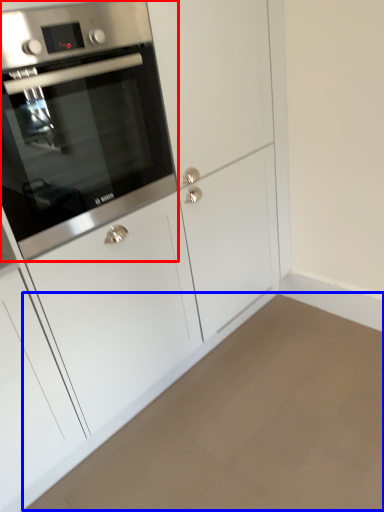
Question: Which point is closer to the camera, oven (highlighted by a red box) or plain (highlighted by a blue box)?

Choices:
 (A) oven
 (B) plain

Answer: (B)